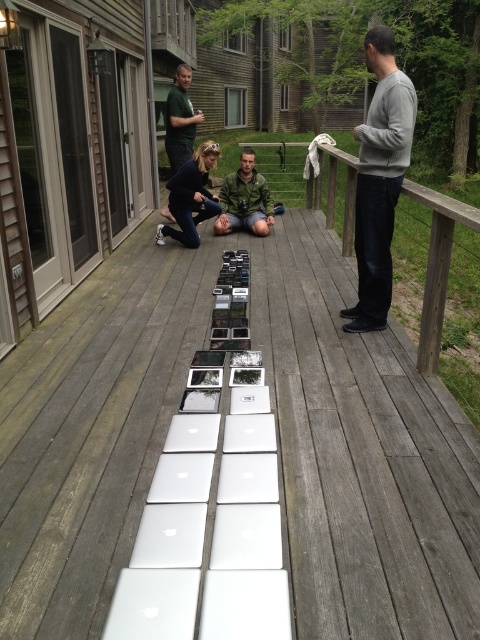
Question: Which point is farther from the camera taking this photo?

Choices:
 (A) (388, 65)
 (B) (222, 218)

Answer: (B)

Question: Does gray sweater at center have a larger size compared to matte black jacket at center?

Choices:
 (A) yes
 (B) no

Answer: (B)

Question: Which point appears farthest from the camera in this image?

Choices:
 (A) (249, 221)
 (B) (348, 221)
 (C) (195, 166)
 (D) (351, 321)

Answer: (A)

Question: Which point is farther to the camera?

Choices:
 (A) green matte jacket at center
 (B) green matte shirt at upper center
 (C) gray sweater at center
 (D) matte black jacket at center

Answer: (A)

Question: Does gray sweater at center have a smaller size compared to wooden at right?

Choices:
 (A) no
 (B) yes

Answer: (A)

Question: Can you confirm if matte black jacket at center is smaller than green matte shirt at upper center?

Choices:
 (A) yes
 (B) no

Answer: (B)